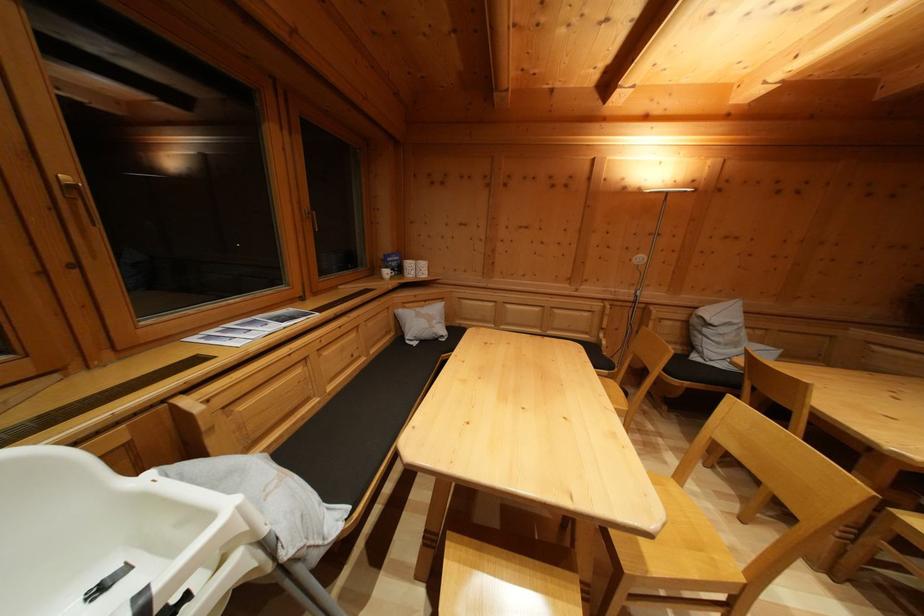
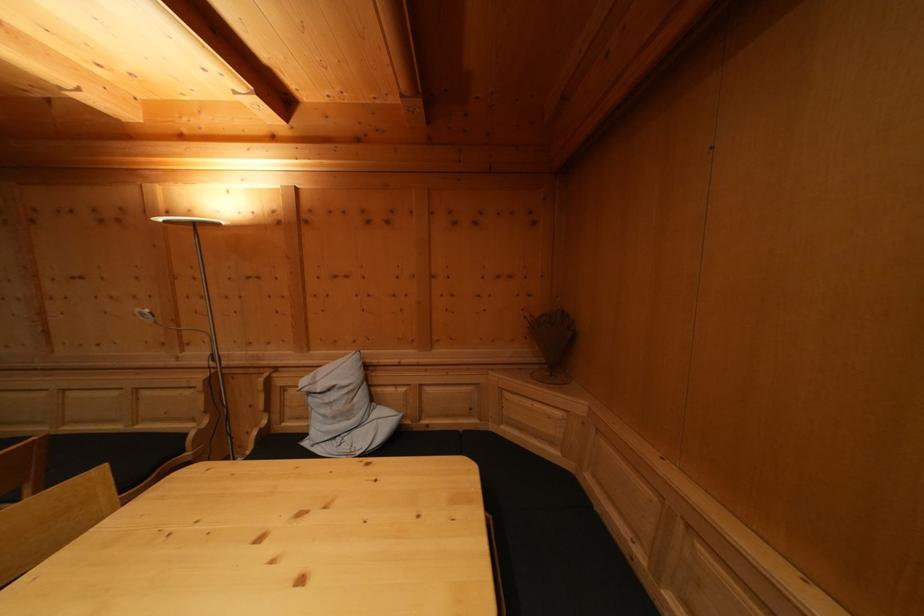
Question: Which direction would the cameraman need to move to produce the second image? Reply with the corresponding letter.

Choices:
 (A) Left
 (B) Right
 (C) Forward
 (D) Backward

Answer: (B)